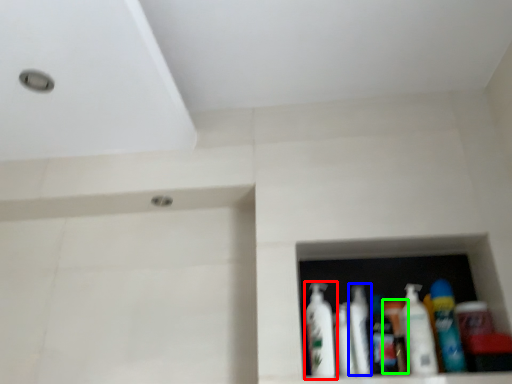
Question: Which object is positioned closest to bottle (highlighted by a red box)? Select from mouthwash (highlighted by a blue box) and toiletry (highlighted by a green box).

Choices:
 (A) mouthwash
 (B) toiletry

Answer: (A)